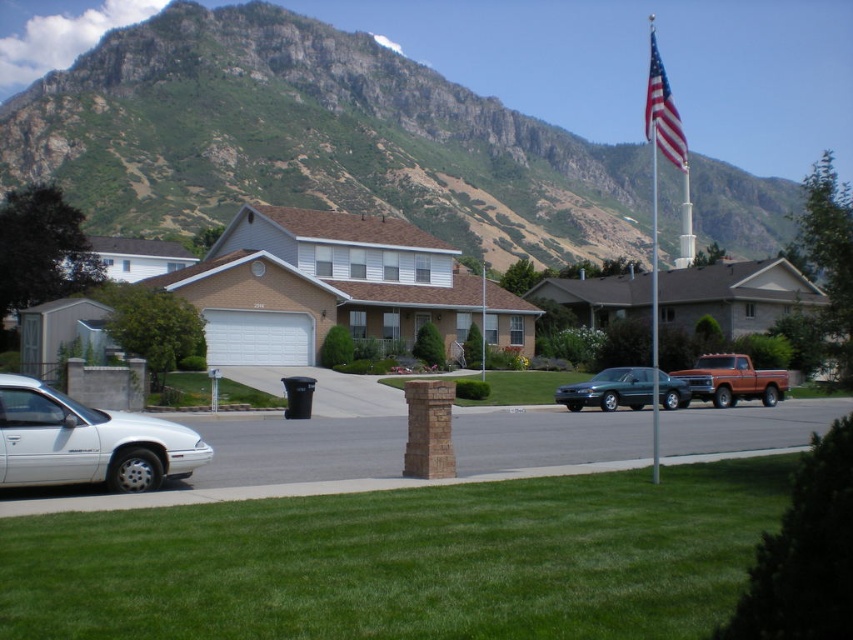
Is point (346, 188) closer to camera compared to point (567, 560)?

No, (346, 188) is behind (567, 560).

Is green rocky mountain at upper center bigger than green grass at lower center?

Yes, green rocky mountain at upper center is bigger than green grass at lower center.

Is point (645, 248) closer to camera compared to point (225, 579)?

No, it is not.

Identify the location of green rocky mountain at upper center. (311, 140).

Can you confirm if green rocky mountain at upper center is shorter than metallic flag pole at center?

Incorrect, green rocky mountain at upper center's height does not fall short of metallic flag pole at center's.

Between green rocky mountain at upper center and metallic flag pole at center, which one appears on the left side from the viewer's perspective?

From the viewer's perspective, green rocky mountain at upper center appears more on the left side.

You are a GUI agent. You are given a task and a screenshot of the screen. Output one action in this format:
    pyautogui.click(x=<x>, y=<y>)
    Task: Click on the green rocky mountain at upper center
    Image resolution: width=853 pixels, height=640 pixels.
    Given the screenshot: What is the action you would take?
    pyautogui.click(x=311, y=140)

At what (x,y) coordinates should I click in order to perform the action: click on green rocky mountain at upper center. Please return your answer as a coordinate pair (x, y). The width and height of the screenshot is (853, 640). Looking at the image, I should click on (311, 140).

Is green grass at lower center smaller than green matte sedan at center?

Actually, green grass at lower center might be larger than green matte sedan at center.

Describe the element at coordinates (404, 561) in the screenshot. This screenshot has width=853, height=640. I see `green grass at lower center` at that location.

In order to click on green grass at lower center in this screenshot , I will do `click(404, 561)`.